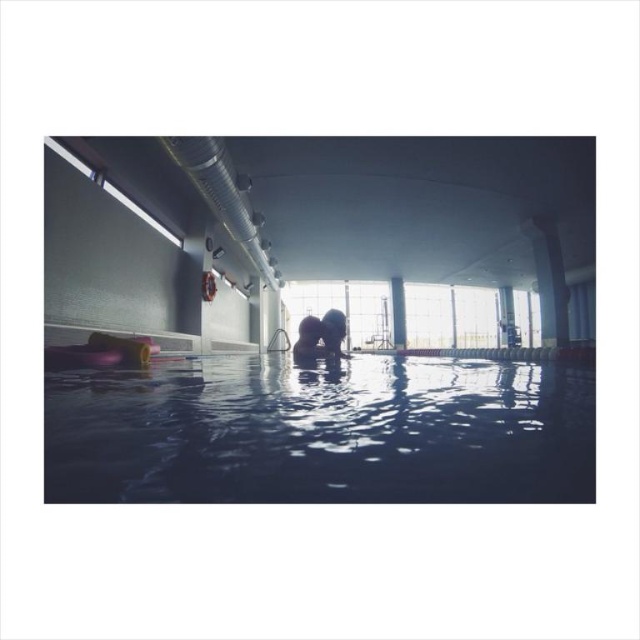
Which is below, transparent plastic swim float at center or smooth skin person at center?

Positioned lower is smooth skin person at center.

Which is more to the right, transparent plastic swim float at center or smooth skin person at center?

transparent plastic swim float at center is more to the right.

Between point (292, 378) and point (308, 356), which one is positioned behind?

The point (308, 356) is more distant.

Find the location of `transparent plastic swim float at center`. transparent plastic swim float at center is located at coordinates (291, 380).

Does transparent plastic swim float at center have a greater height compared to transparent blue water at center?

Yes, transparent plastic swim float at center is taller than transparent blue water at center.

Based on the photo, can you confirm if transparent plastic swim float at center is positioned to the left of transparent blue water at center?

In fact, transparent plastic swim float at center is to the right of transparent blue water at center.

Is point (488, 288) farther from camera compared to point (120, 442)?

Yes, it is.

Find the location of a particular element. transparent plastic swim float at center is located at coordinates (291, 380).

Between point (129, 376) and point (323, 333), which one is positioned behind?

Point (323, 333)

From the picture: Does transparent blue water at center appear over smooth skin person at center?

Yes, transparent blue water at center is above smooth skin person at center.

The width and height of the screenshot is (640, 640). Find the location of `transparent blue water at center`. transparent blue water at center is located at coordinates (323, 433).

You are a GUI agent. You are given a task and a screenshot of the screen. Output one action in this format:
    pyautogui.click(x=<x>, y=<y>)
    Task: Click on the transparent blue water at center
    
    Given the screenshot: What is the action you would take?
    pyautogui.click(x=323, y=433)